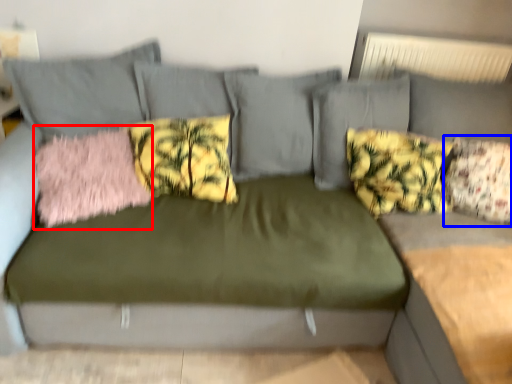
Question: Which object appears farthest to the camera in this image, pillow (highlighted by a red box) or pillow (highlighted by a blue box)?

Choices:
 (A) pillow
 (B) pillow

Answer: (B)